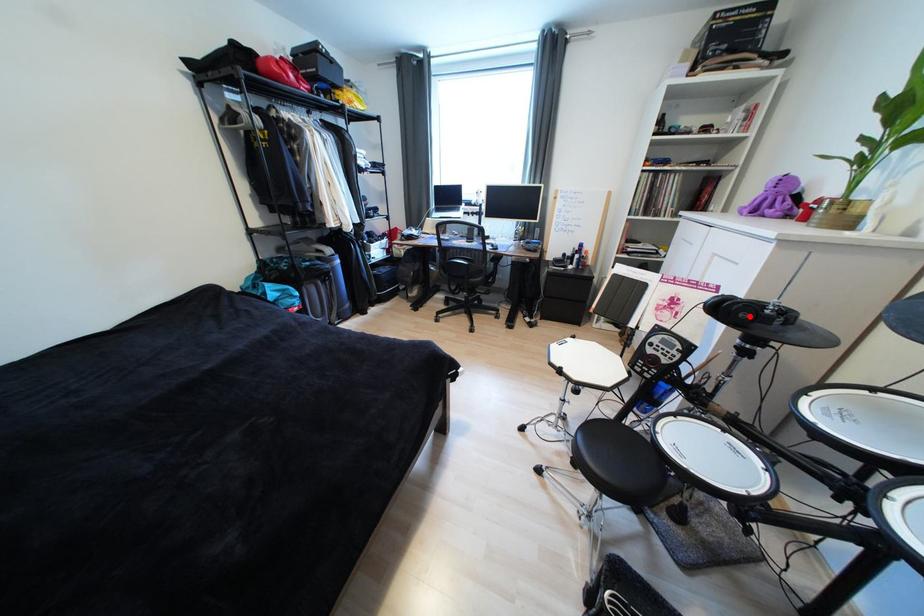
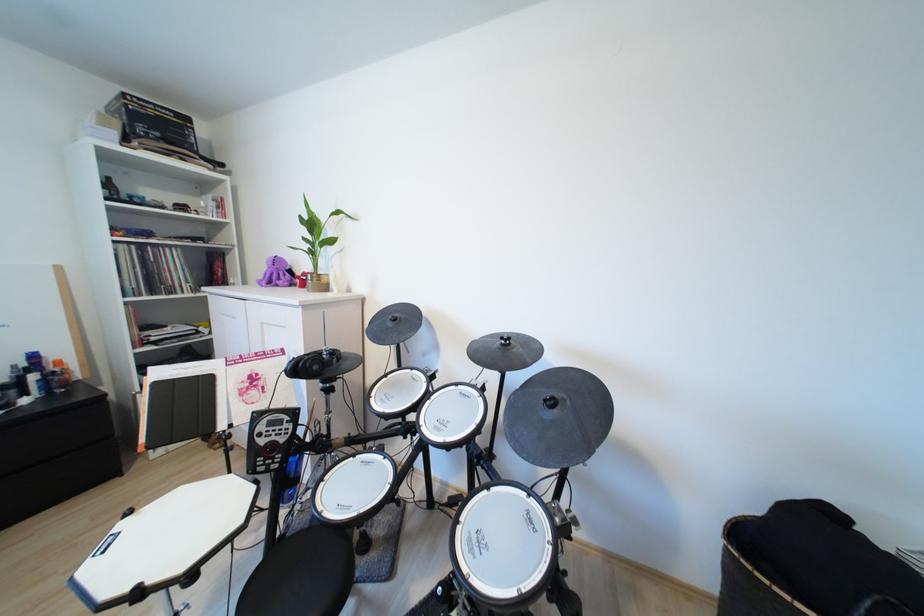
Find the pixel in the second image that matches the highlighted location in the first image.

(322, 369)